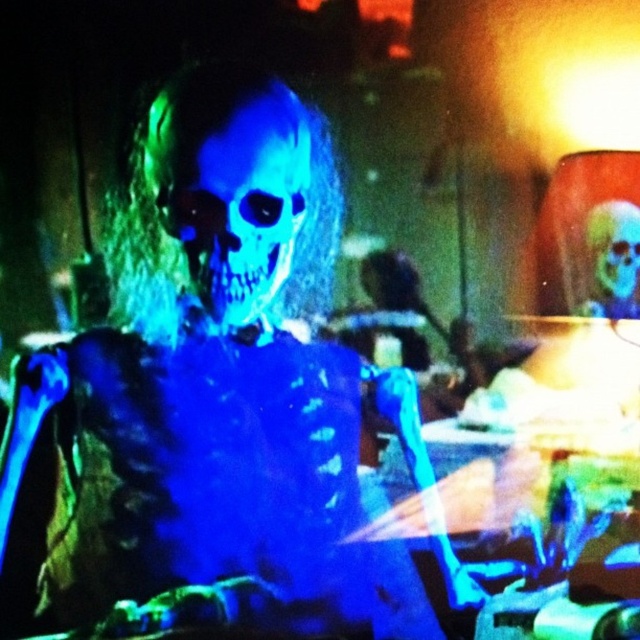
You are a ghost hunter standing at the edge of the scene. You see the blue translucent skeleton at center and another similar figure in the background. How far apart are these two skeletal figures?

The two skeletal figures are 4.41 feet apart.

You are a ghost hunter analyzing the scene. You notice two blue translucent figures at the center. Which one is taller between the blue translucent skeleton at center and the translucent blue skull at center?

The blue translucent skeleton at center is taller than the translucent blue skull at center.